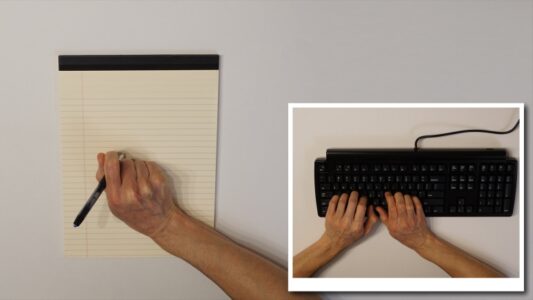
Find the location of `pen`. pen is located at coordinates (92, 197).